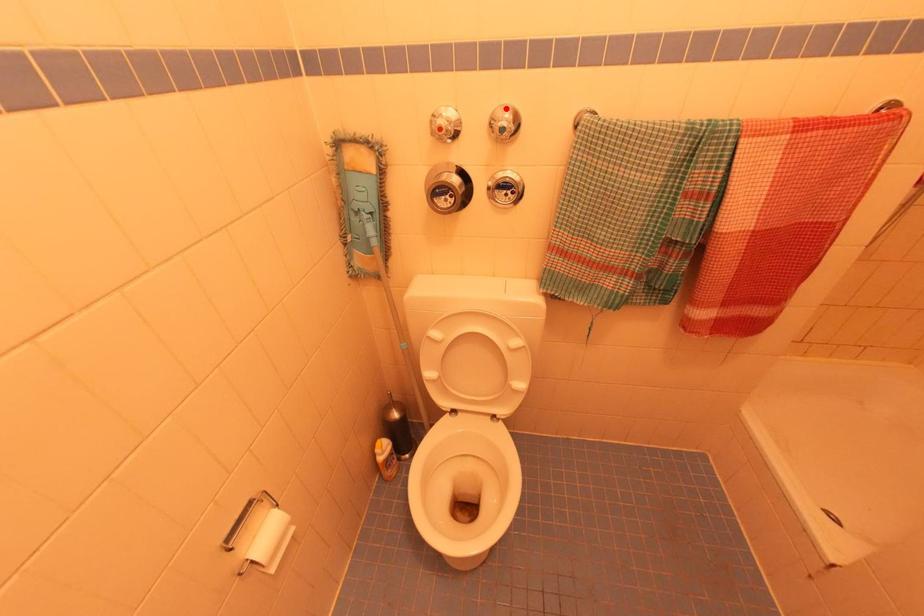
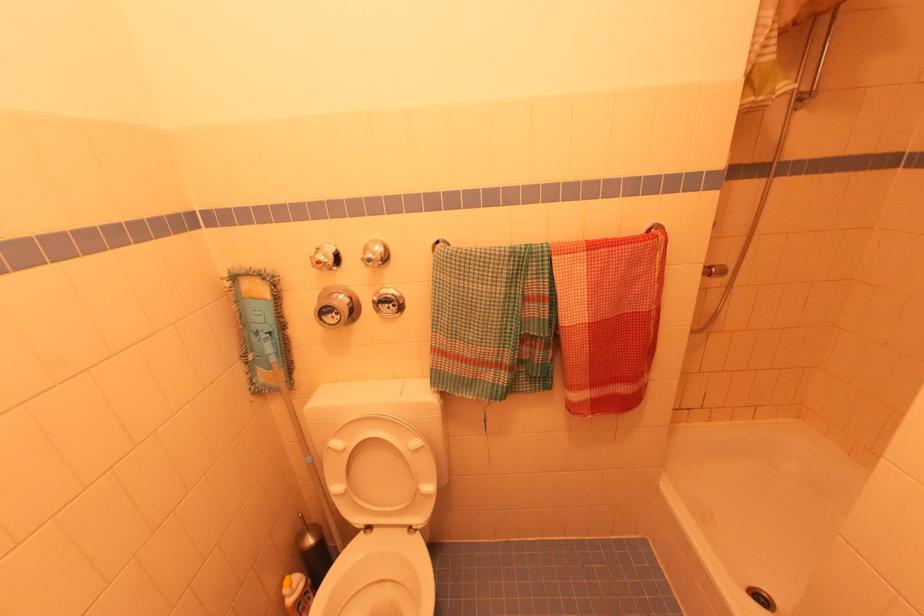
Locate, in the second image, the point that corresponds to the highlighted location in the first image.

(377, 243)